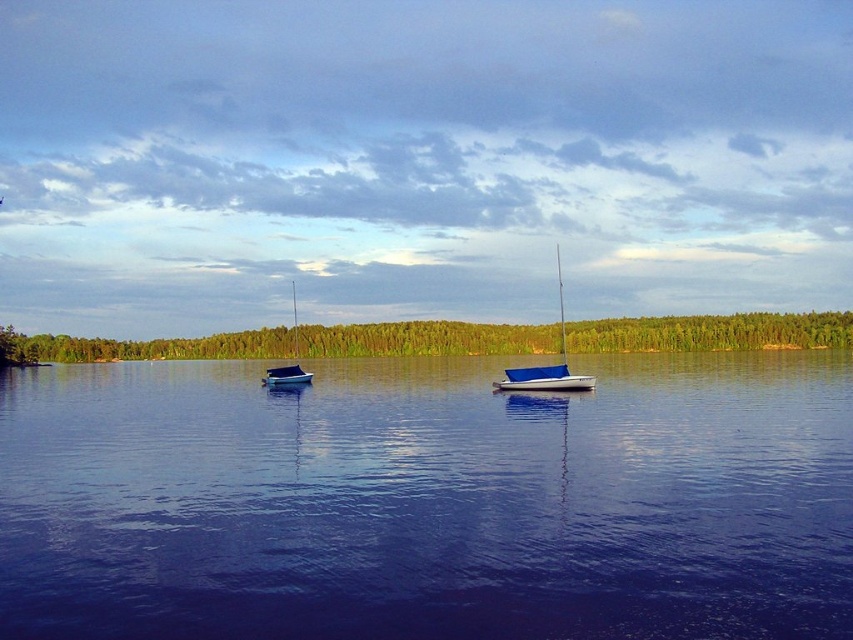
Question: From the image, what is the correct spatial relationship of blue canvas sailboat at center in relation to blue matte sailboat at center?

Choices:
 (A) right
 (B) left

Answer: (A)

Question: Considering the relative positions of blue water at center and blue canvas sailboat at center in the image provided, where is blue water at center located with respect to blue canvas sailboat at center?

Choices:
 (A) right
 (B) left

Answer: (B)

Question: Which object is positioned closest to the blue water at center?

Choices:
 (A) blue matte sailboat at center
 (B) blue canvas sailboat at center

Answer: (A)

Question: Based on their relative distances, which object is nearer to the blue water at center?

Choices:
 (A) blue canvas sailboat at center
 (B) blue matte sailboat at center

Answer: (B)

Question: Which point is farther to the camera?

Choices:
 (A) (300, 372)
 (B) (538, 387)
 (C) (132, 625)

Answer: (A)

Question: Can you confirm if blue canvas sailboat at center is positioned to the right of blue matte sailboat at center?

Choices:
 (A) yes
 (B) no

Answer: (A)